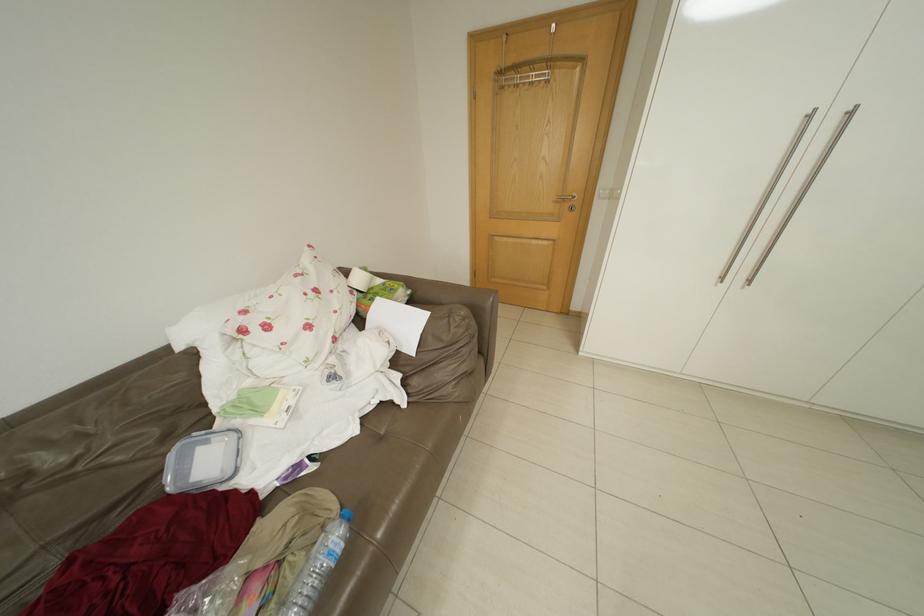
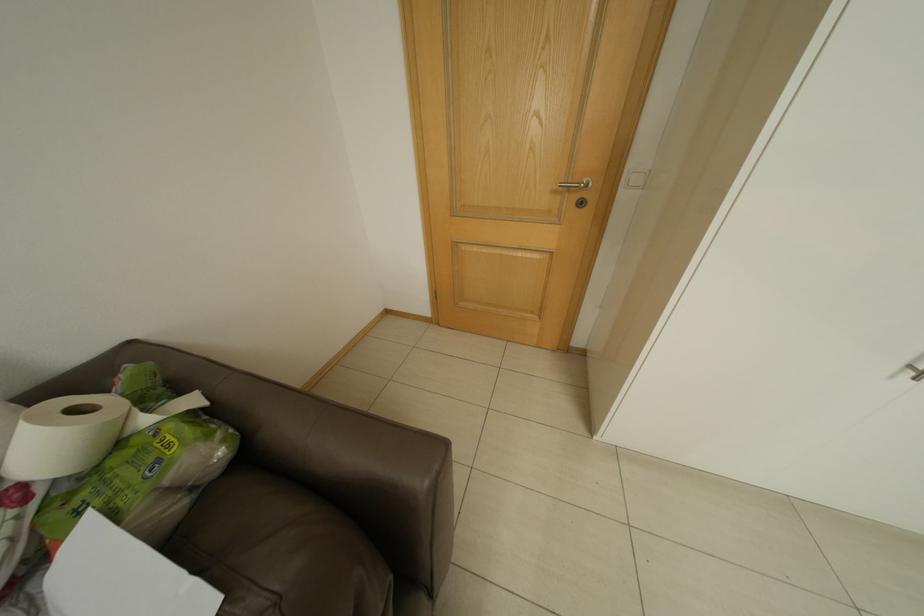
Question: Which direction would the cameraman need to move to produce the second image? Reply with the corresponding letter.

Choices:
 (A) Left
 (B) Right
 (C) Forward
 (D) Backward

Answer: (C)